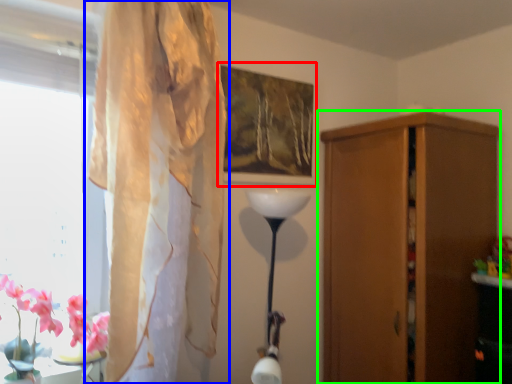
Question: Which is nearer to the picture frame (highlighted by a red box)? curtain (highlighted by a blue box) or cupboard (highlighted by a green box).

Choices:
 (A) curtain
 (B) cupboard

Answer: (A)